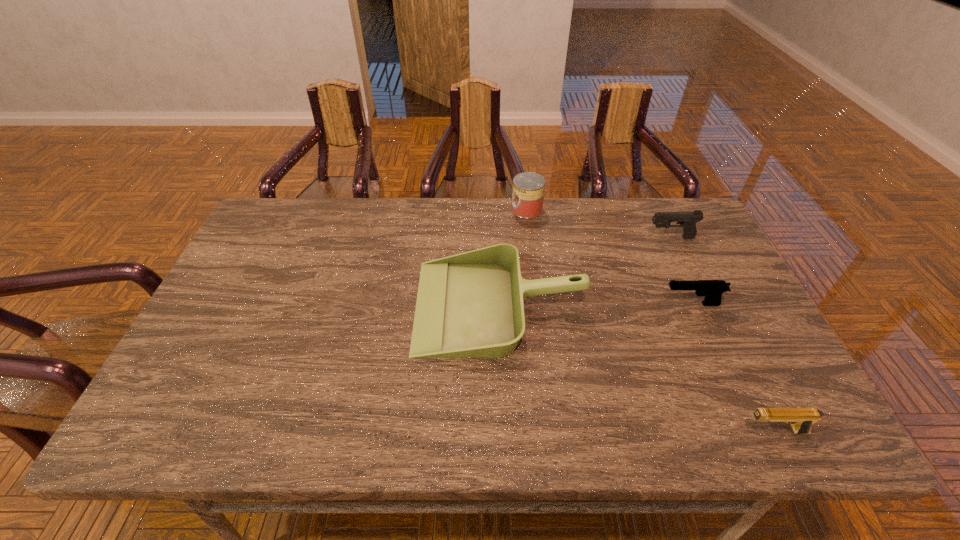
You are a GUI agent. You are given a task and a screenshot of the screen. Output one action in this format:
    pyautogui.click(x=<x>, y=<y>)
    Task: Click on the farthest object
    The image size is (960, 540).
    Given the screenshot: What is the action you would take?
    pyautogui.click(x=528, y=188)

Locate an element on the screen. The width and height of the screenshot is (960, 540). dustpan is located at coordinates (470, 305).

Identify the location of the farthest pistol. This screenshot has height=540, width=960. (687, 220).

Locate an element on the screen. The height and width of the screenshot is (540, 960). the second farthest pistol is located at coordinates (712, 289).

Image resolution: width=960 pixels, height=540 pixels. Find the location of `the nearest pistol`. the nearest pistol is located at coordinates (801, 419).

At what (x,y) coordinates should I click in order to perform the action: click on vacant space located on the front of the can. Please return your answer as a coordinate pair (x, y). Looking at the image, I should click on (536, 280).

The height and width of the screenshot is (540, 960). What are the coordinates of `free space located on the scoop of the dustpan` in the screenshot? It's located at (277, 306).

Image resolution: width=960 pixels, height=540 pixels. Identify the location of vacant point located on the scoop of the dustpan. (374, 306).

Identify the location of free location located 0.350m on the scoop of the dustpan. (285, 306).

Where is `vacant space situated at the barrel of the farthest pistol`? vacant space situated at the barrel of the farthest pistol is located at coordinates (625, 238).